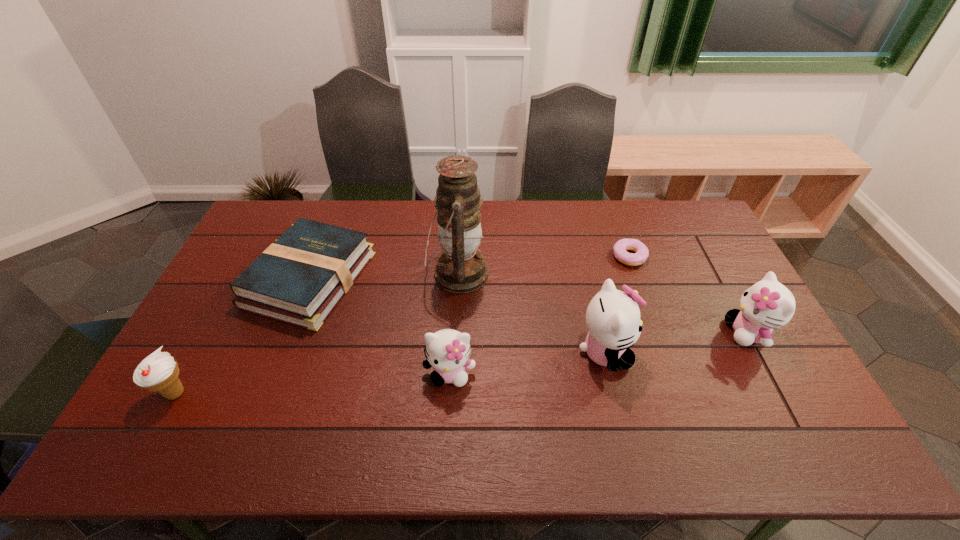
This screenshot has width=960, height=540. I want to click on icecream located at the near edge, so click(158, 372).

At what (x,y) coordinates should I click in order to perform the action: click on hardback book located in the left edge section of the desktop. Please return your answer as a coordinate pair (x, y). Image resolution: width=960 pixels, height=540 pixels. Looking at the image, I should click on (299, 279).

I want to click on icecream present at the left edge, so click(x=158, y=372).

The image size is (960, 540). I want to click on object situated at the right edge, so click(766, 305).

The width and height of the screenshot is (960, 540). I want to click on object at the far left corner, so click(299, 279).

You are a GUI agent. You are given a task and a screenshot of the screen. Output one action in this format:
    pyautogui.click(x=<x>, y=<y>)
    Task: Click on the object that is positioned at the near left corner
    
    Given the screenshot: What is the action you would take?
    pyautogui.click(x=158, y=372)

The image size is (960, 540). In order to click on vacant space at the far edge of the desktop in this screenshot , I will do `click(601, 203)`.

Identify the location of vacant space at the near edge of the desktop. (648, 401).

Where is `vacant space at the left edge of the desktop`? The image size is (960, 540). vacant space at the left edge of the desktop is located at coordinates (239, 268).

In order to click on free space at the right edge in this screenshot , I will do `click(734, 277)`.